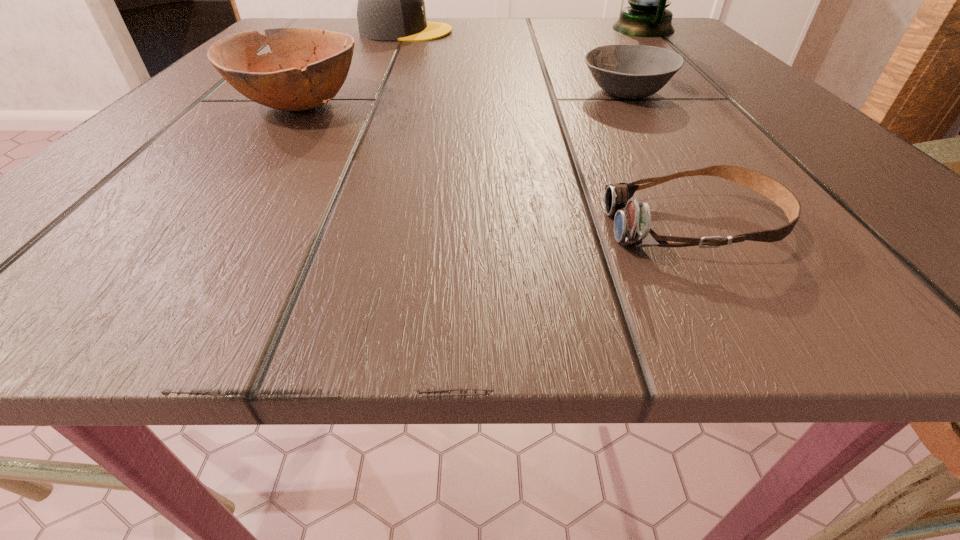
The height and width of the screenshot is (540, 960). What are the coordinates of `the tallest object` in the screenshot? It's located at pos(646,16).

You are a GUI agent. You are given a task and a screenshot of the screen. Output one action in this format:
    pyautogui.click(x=<x>, y=<y>)
    Task: Click on the cap
    The height and width of the screenshot is (540, 960).
    Given the screenshot: What is the action you would take?
    pyautogui.click(x=391, y=6)

Locate an element on the screen. the taller bowl is located at coordinates (306, 68).

Identify the location of the right bowl. This screenshot has height=540, width=960. (626, 71).

The image size is (960, 540). I want to click on goggles, so click(632, 221).

The width and height of the screenshot is (960, 540). Find the location of `vacant space located on the side where the lantern emits light`. vacant space located on the side where the lantern emits light is located at coordinates (437, 29).

The image size is (960, 540). In order to click on vacant space situated 0.090m on the side where the lantern emits light in this screenshot , I will do `click(566, 29)`.

Locate an element on the screen. vacant space located on the side where the lantern emits light is located at coordinates (540, 29).

Where is `free space located on the front-facing side of the cap`? The image size is (960, 540). free space located on the front-facing side of the cap is located at coordinates (588, 32).

This screenshot has height=540, width=960. In order to click on blank space located on the back of the left bowl in this screenshot , I will do `click(346, 44)`.